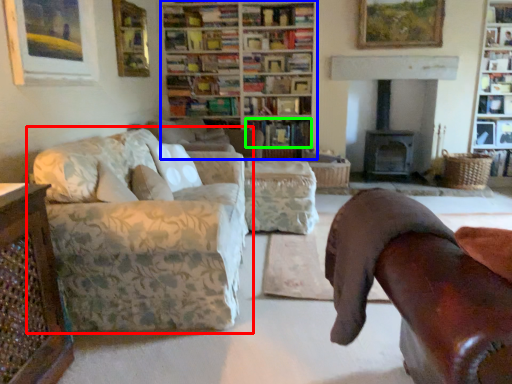
Question: Which is nearer to the studio couch (highlighted by a red box)? bookcase (highlighted by a blue box) or book (highlighted by a green box).

Choices:
 (A) bookcase
 (B) book

Answer: (B)